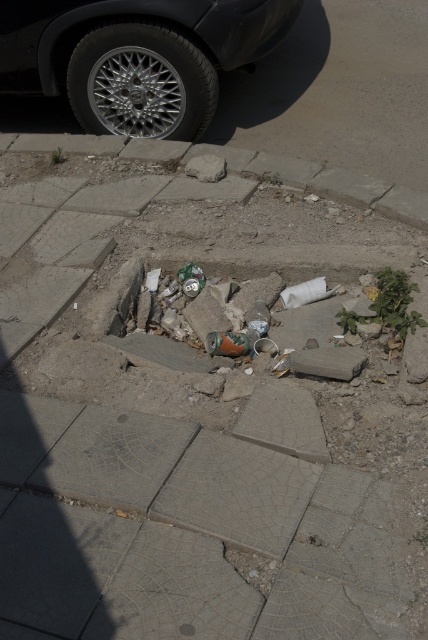
Does silver metallic tire at upper left appear over gray concrete curb at lower center?

Yes.

Is the position of silver metallic tire at upper left more distant than that of gray concrete curb at lower center?

Yes, it is.

Where is `silver metallic tire at upper left`? The width and height of the screenshot is (428, 640). silver metallic tire at upper left is located at coordinates (140, 83).

Does shiny black tire at upper left have a lesser height compared to silver metallic tire at upper left?

Incorrect, shiny black tire at upper left's height does not fall short of silver metallic tire at upper left's.

Is shiny black tire at upper left bigger than silver metallic tire at upper left?

Yes, shiny black tire at upper left is bigger than silver metallic tire at upper left.

Is point (137, 32) farther from camera compared to point (186, 84)?

No, (137, 32) is closer to viewer.

This screenshot has width=428, height=640. I want to click on shiny black tire at upper left, so click(x=136, y=56).

Is point (115, 22) more distant than point (267, 176)?

That is True.

Is shiny black tire at upper left to the left of gray concrete curb at lower center from the viewer's perspective?

Yes, shiny black tire at upper left is to the left of gray concrete curb at lower center.

I want to click on shiny black tire at upper left, so (x=136, y=56).